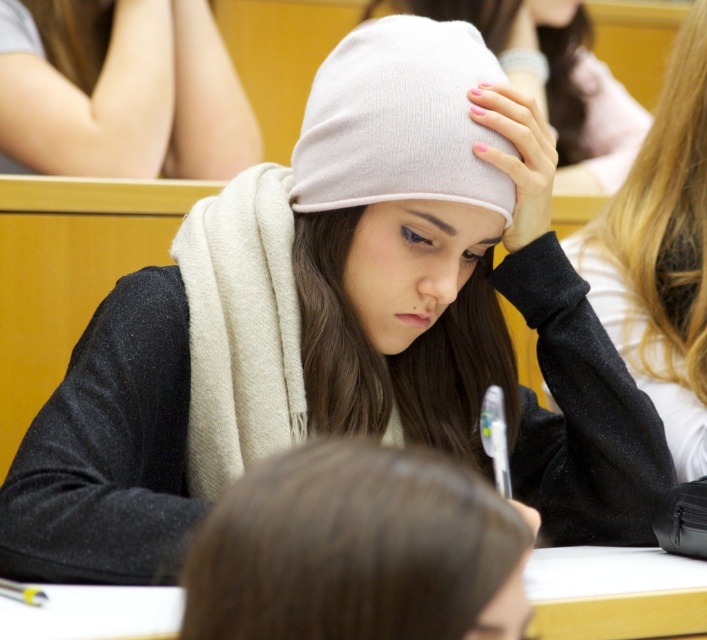
In the classroom scene, there is a point located at coordinates (358, 548). Based on the description, what object or feature in the scene does this point correspond to?

The point at (358, 548) corresponds to the brown matte hair at center.

You are a student sitting at the back of the classroom. You notice the brown matte hair at center and the white knit beanie at upper center. Which object is closer to the front of the classroom?

The brown matte hair at center is closer to the front of the classroom because it is shorter than the white knit beanie at upper center, which is positioned higher up.